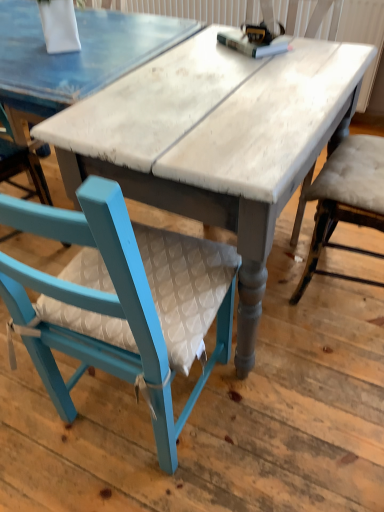
This screenshot has width=384, height=512. What are the coordinates of `empty space that is ontop of white painted wood table at center (from a real-world perspective)` in the screenshot? It's located at (228, 80).